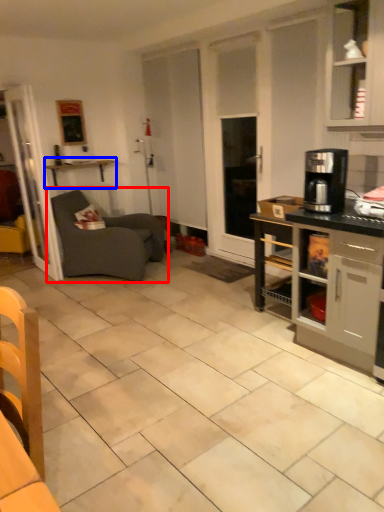
Question: Which of the following is the closest to the observer, studio couch (highlighted by a red box) or shelf (highlighted by a blue box)?

Choices:
 (A) studio couch
 (B) shelf

Answer: (A)